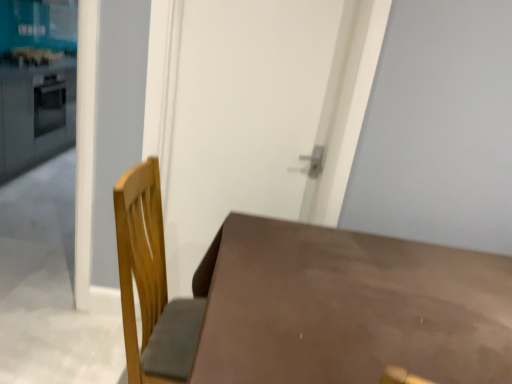
Question: Is brown matte table at lower left at the right side of matte white counter top at left, positioned as the second counter top in top-to-bottom order?

Choices:
 (A) yes
 (B) no

Answer: (A)

Question: Is the depth of brown matte table at lower left greater than that of matte white counter top at left, the first counter top when ordered from bottom to top?

Choices:
 (A) yes
 (B) no

Answer: (B)

Question: From a real-world perspective, is brown matte table at lower left located beneath matte white counter top at left, positioned as the second counter top in top-to-bottom order?

Choices:
 (A) yes
 (B) no

Answer: (A)

Question: Does brown matte table at lower left turn towards matte white counter top at left, positioned as the second counter top in top-to-bottom order?

Choices:
 (A) no
 (B) yes

Answer: (A)

Question: Is brown matte table at lower left not close to matte white counter top at left, the first counter top when ordered from bottom to top?

Choices:
 (A) yes
 (B) no

Answer: (A)

Question: Considering the relative sizes of brown matte table at lower left and matte white counter top at left, the first counter top when ordered from bottom to top, in the image provided, is brown matte table at lower left smaller than matte white counter top at left, the first counter top when ordered from bottom to top,?

Choices:
 (A) no
 (B) yes

Answer: (A)

Question: From a real-world perspective, is matte white counter top at upper left, which appears as the 1th counter top when viewed from the top, on matte white counter top at left, the first counter top when ordered from bottom to top?

Choices:
 (A) yes
 (B) no

Answer: (A)

Question: From the image's perspective, is matte white counter top at upper left, the 2th counter top in the bottom-to-top sequence, above matte white counter top at left, positioned as the second counter top in top-to-bottom order?

Choices:
 (A) no
 (B) yes

Answer: (B)

Question: From the image's perspective, is matte white counter top at upper left, which appears as the 1th counter top when viewed from the top, located beneath matte white counter top at left, the first counter top when ordered from bottom to top?

Choices:
 (A) yes
 (B) no

Answer: (B)

Question: Is matte white counter top at upper left, which appears as the 1th counter top when viewed from the top, not within matte white counter top at left, positioned as the second counter top in top-to-bottom order?

Choices:
 (A) no
 (B) yes

Answer: (B)

Question: Can you confirm if matte white counter top at upper left, which appears as the 1th counter top when viewed from the top, is smaller than matte white counter top at left, positioned as the second counter top in top-to-bottom order?

Choices:
 (A) yes
 (B) no

Answer: (A)

Question: Is matte white counter top at upper left, which appears as the 1th counter top when viewed from the top, next to matte white counter top at left, positioned as the second counter top in top-to-bottom order?

Choices:
 (A) no
 (B) yes

Answer: (A)

Question: Is brown matte table at lower left at the left side of matte white counter top at upper left, which appears as the 1th counter top when viewed from the top?

Choices:
 (A) yes
 (B) no

Answer: (B)